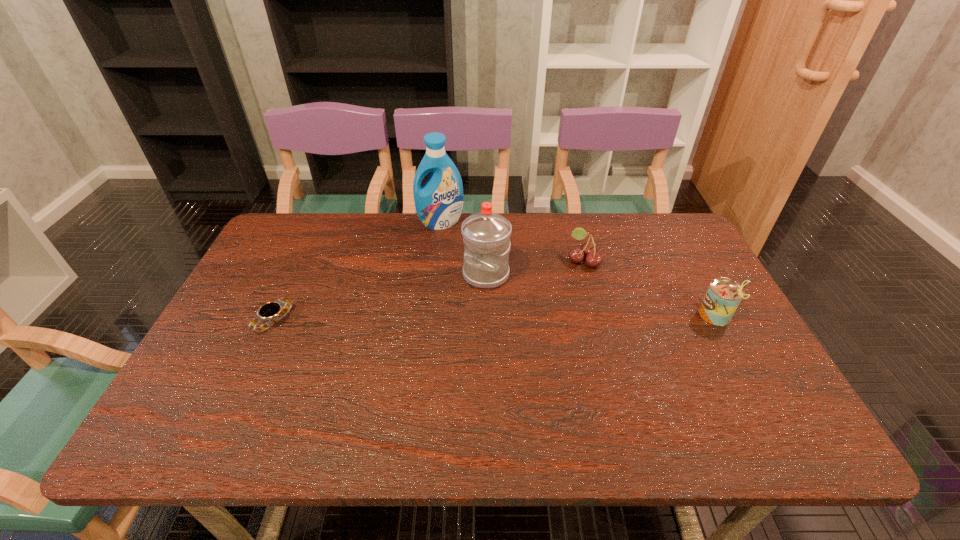
Where is `vacant space located on the handle side of the third object from left to right`? vacant space located on the handle side of the third object from left to right is located at coordinates (391, 375).

Locate an element on the screen. This screenshot has width=960, height=540. detergent located at the far edge is located at coordinates (439, 202).

The height and width of the screenshot is (540, 960). In order to click on cherry positioned at the far edge in this screenshot , I will do `click(588, 249)`.

This screenshot has width=960, height=540. I want to click on object present at the left edge, so (274, 311).

The width and height of the screenshot is (960, 540). I want to click on object at the right edge, so click(x=724, y=295).

In the image, there is a desktop. Find the location of `vacant space at the far edge`. vacant space at the far edge is located at coordinates (351, 233).

Locate an element on the screen. The height and width of the screenshot is (540, 960). free space at the near edge of the desktop is located at coordinates (643, 408).

In the image, there is a desktop. Find the location of `free space at the left edge`. free space at the left edge is located at coordinates (266, 271).

In order to click on vacant space at the right edge of the desktop in this screenshot , I will do `click(701, 281)`.

The height and width of the screenshot is (540, 960). I want to click on vacant space at the far left corner, so click(x=308, y=221).